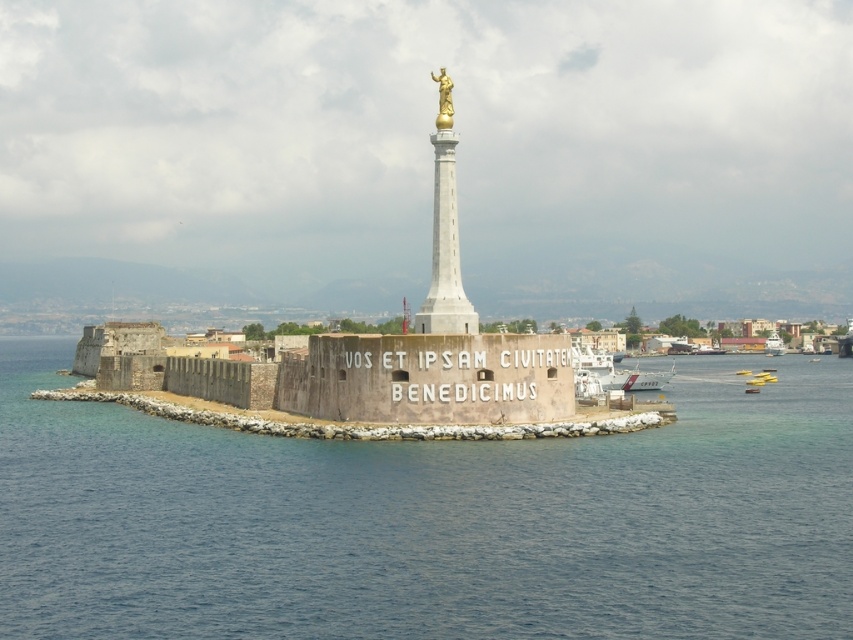
Is gray concrete wall at center closer to camera compared to gold polished statue at center?

Yes, it is in front of gold polished statue at center.

Does point (584, 424) come in front of point (453, 170)?

Yes.

Is point (527, 422) less distant than point (456, 259)?

That is True.

Identify the location of gray concrete wall at center. The width and height of the screenshot is (853, 640). (358, 422).

Is blue water at center behind gray concrete wall at center?

No, blue water at center is in front of gray concrete wall at center.

Which is below, blue water at center or gray concrete wall at center?

blue water at center is below.

Where is `blue water at center`? The image size is (853, 640). blue water at center is located at coordinates (430, 520).

Measure the distance between blue water at center and brown stone fort at center.

A distance of 11.62 meters exists between blue water at center and brown stone fort at center.

Which is behind, point (468, 556) or point (491, 353)?

The point (491, 353) is behind.

I want to click on blue water at center, so click(x=430, y=520).

The height and width of the screenshot is (640, 853). I want to click on blue water at center, so click(x=430, y=520).